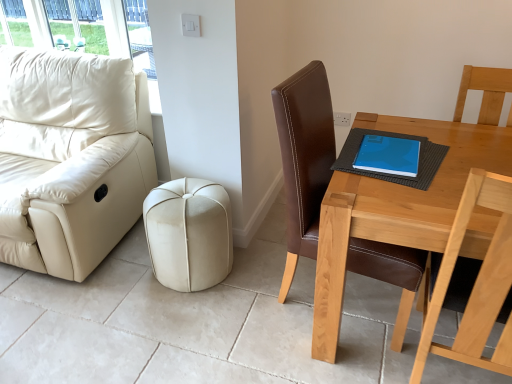
Identify the location of free space above blue matte notebook at table (from a real-world perspective). (395, 160).